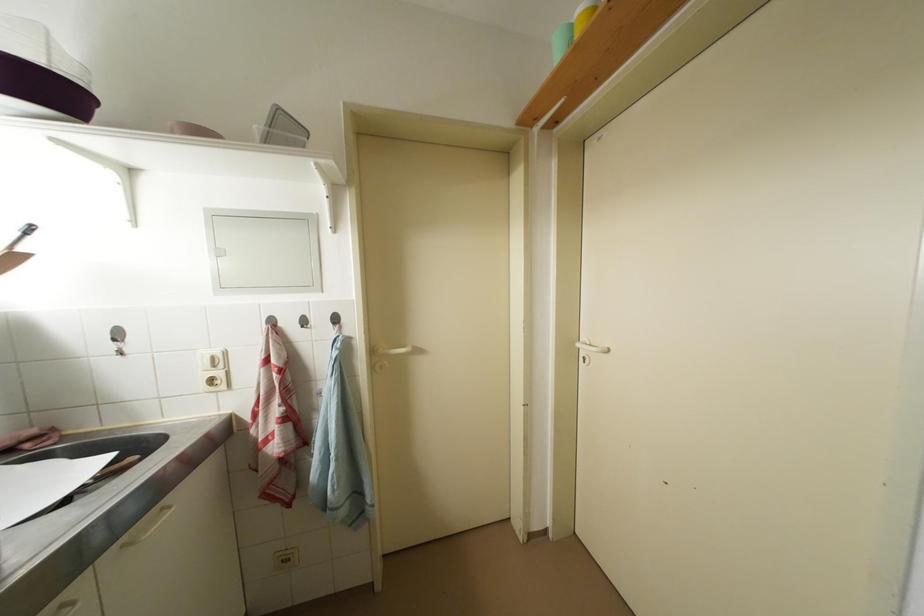
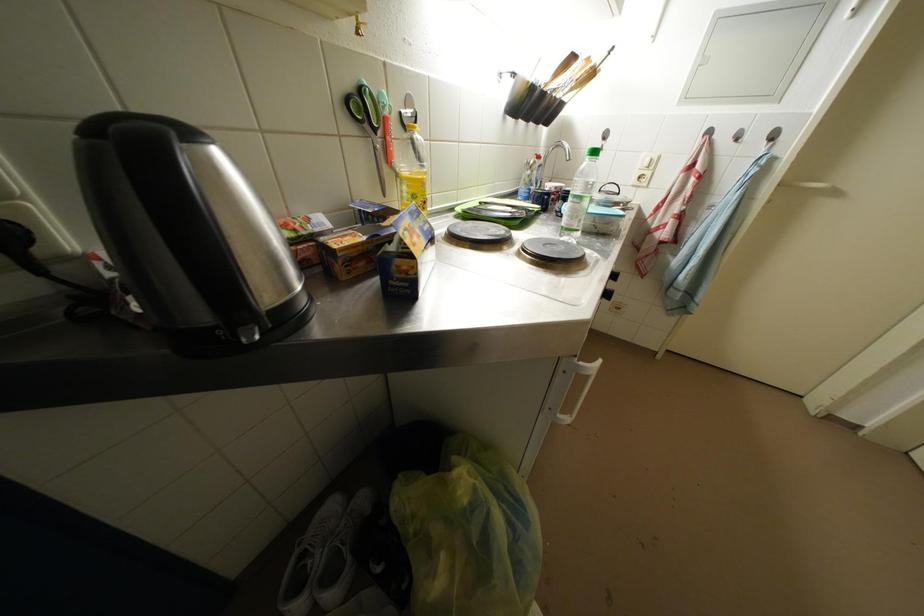
First-person continuous shooting, in which direction is the camera rotating?

The rotation direction of the camera is left-down.